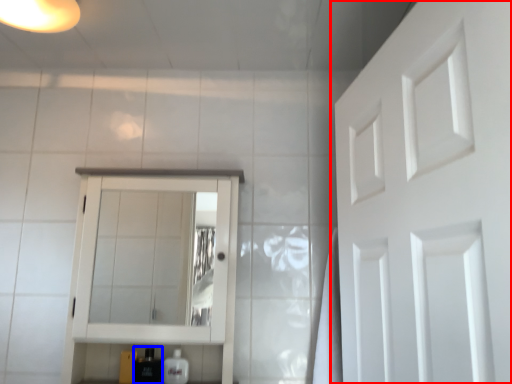
Question: Which of the following is the closest to the observer, door (highlighted by a red box) or toiletry (highlighted by a blue box)?

Choices:
 (A) door
 (B) toiletry

Answer: (A)